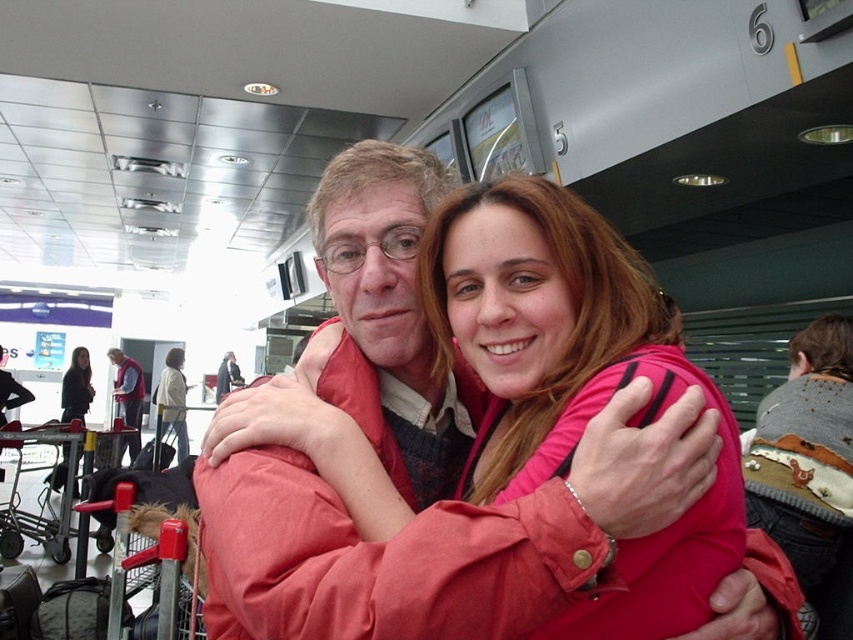
You are a traveler who needs to decide which item to take from the center area. The pink fabric at center and the light beige sweater at center are both available. Which one is shorter in length and thus easier to pack?

The pink fabric at center is shorter than the light beige sweater at center, so it would be easier to pack.

You are a traveler who just arrived at the airport terminal. You see a pink fabric at center and a black leather jacket at left. Which one is smaller in size?

The pink fabric at center is smaller in size compared to the black leather jacket at left.

You are an airport security officer checking the dimensions of items. You see the pink fabric at center and the light beige sweater at center. Which item has a smaller width?

The pink fabric at center has a lesser width compared to the light beige sweater at center.